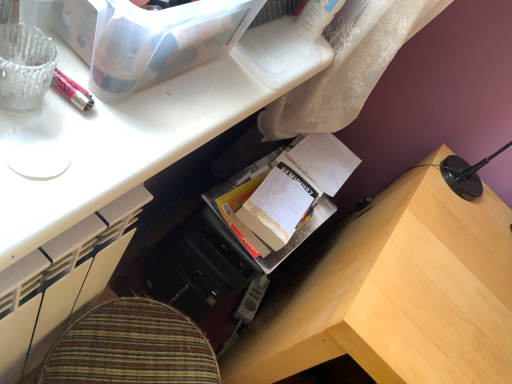
Question: From their relative heights in the image, would you say wooden desk at lower right is taller or shorter than cardboard book at center?

Choices:
 (A) tall
 (B) short

Answer: (A)

Question: Considering the relative positions of wooden desk at lower right and cardboard book at center in the image provided, is wooden desk at lower right to the left or to the right of cardboard book at center?

Choices:
 (A) left
 (B) right

Answer: (B)

Question: Which object is the farthest from the cardboard book at center?

Choices:
 (A) wooden desk at lower right
 (B) white paper notebook at center
 (C) transparent plastic storage box at upper left
 (D) translucent glass pen at upper left
 (E) wooden desk at center

Answer: (D)

Question: Estimate the real-world distances between objects in this image. Which object is farther from the wooden desk at lower right?

Choices:
 (A) transparent plastic storage box at upper left
 (B) translucent glass pen at upper left
 (C) white paper notebook at center
 (D) cardboard book at center
 (E) wooden desk at center

Answer: (B)